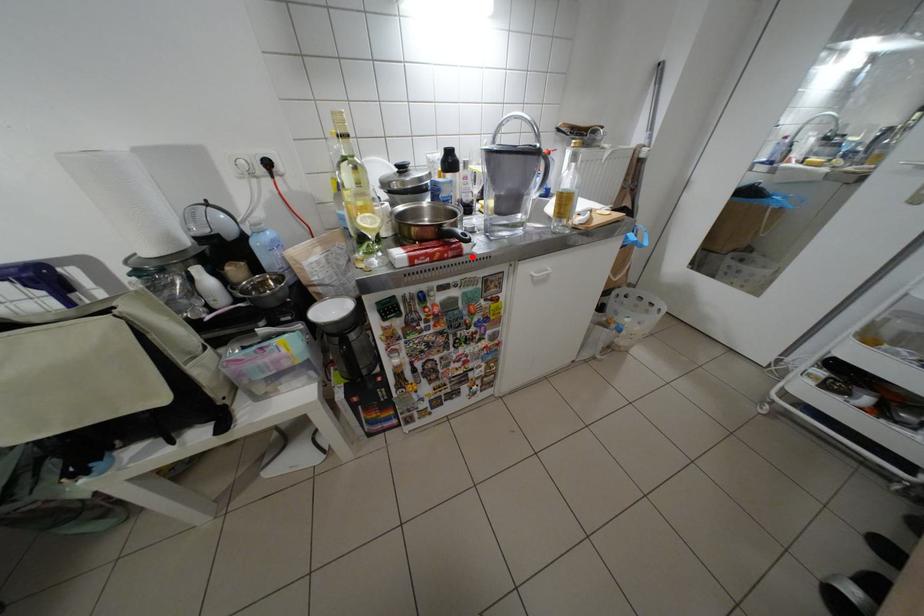
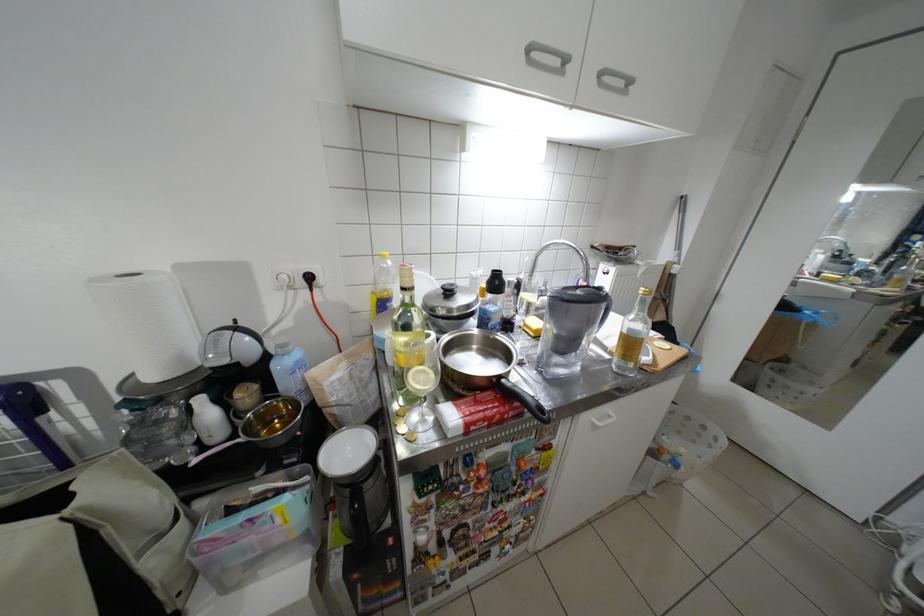
The point at the highlighted location is marked in the first image. Where is the corresponding point in the second image?

(532, 415)